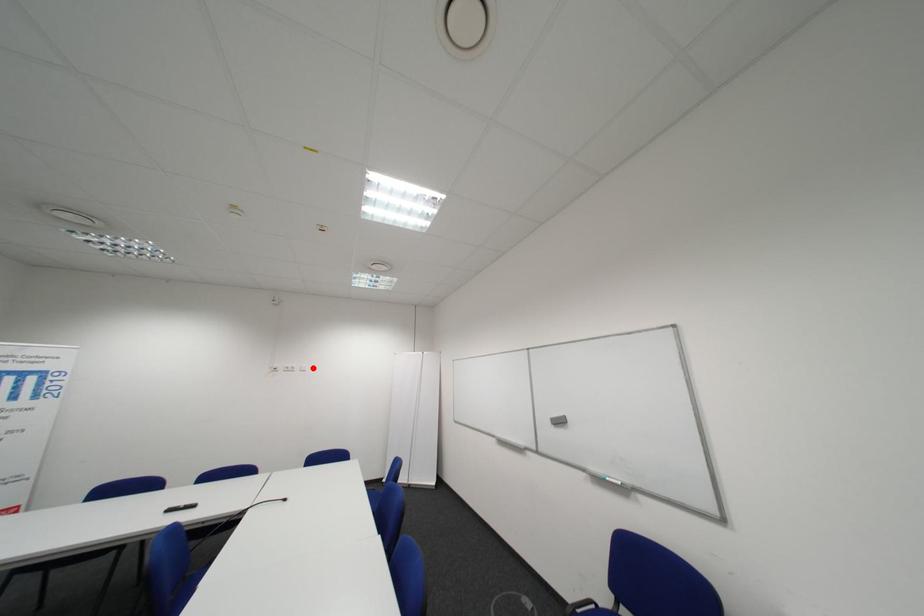
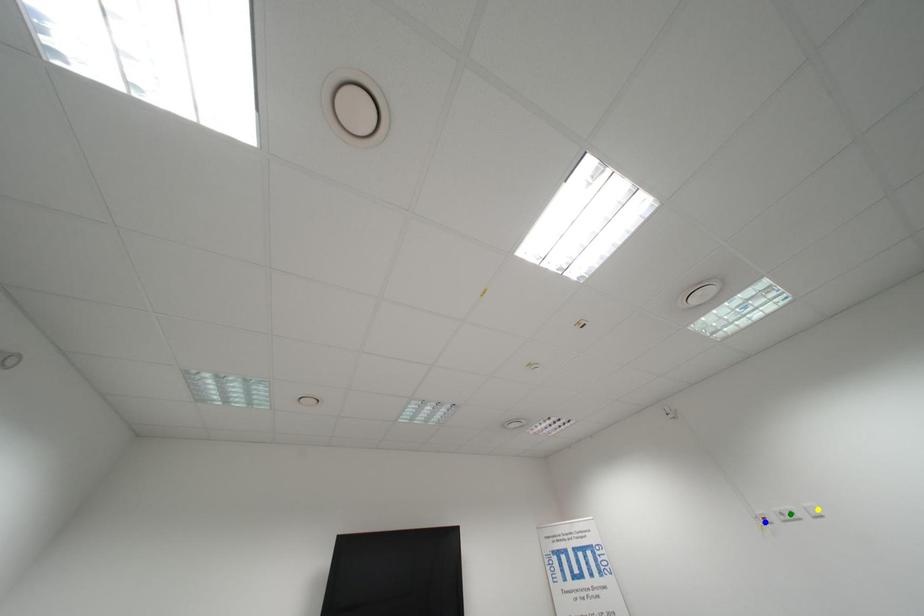
Question: I am providing you with two images of the same scene from different viewpoints. A red point is marked on the first image. You are given multiple points on the second image. Which spot in image 2 lines up with the point in image 1?

Choices:
 (A) yellow point
 (B) blue point
 (C) green point

Answer: (A)